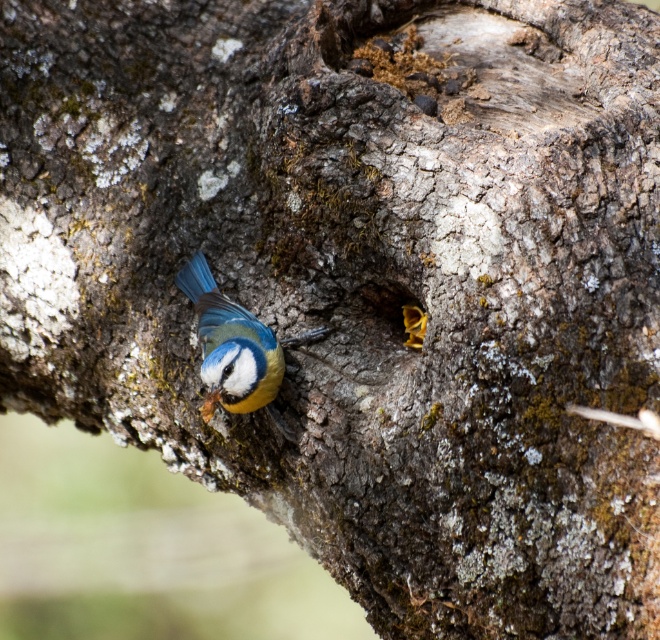
Question: Observing the image, what is the correct spatial positioning of blue matte bird at center in reference to yellow wood at center?

Choices:
 (A) above
 (B) below

Answer: (B)

Question: Which of the following is the farthest from the observer?

Choices:
 (A) yellow wood at center
 (B) blue matte bird at center

Answer: (A)

Question: Does blue matte bird at center appear on the right side of yellow wood at center?

Choices:
 (A) no
 (B) yes

Answer: (A)

Question: Is blue matte bird at center positioned before yellow wood at center?

Choices:
 (A) yes
 (B) no

Answer: (A)